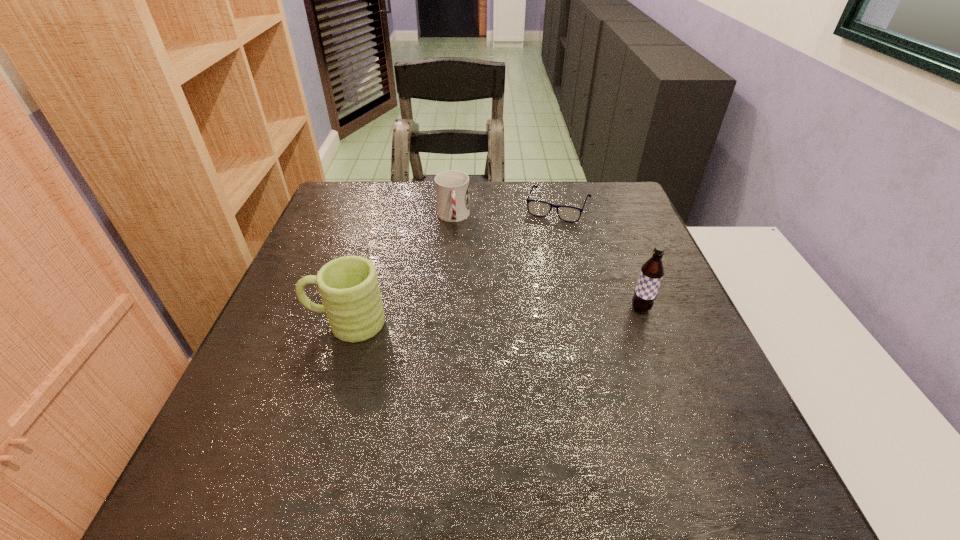
In the image, there is a desktop. At what (x,y) coordinates should I click in order to perform the action: click on vacant space at the near edge. Please return your answer as a coordinate pair (x, y). Looking at the image, I should click on (335, 402).

In the image, there is a desktop. Find the location of `vacant space at the left edge`. vacant space at the left edge is located at coordinates coord(264,346).

This screenshot has height=540, width=960. I want to click on vacant space at the near left corner, so click(x=257, y=432).

In the image, there is a desktop. Identify the location of vacant space at the far right corner. The image size is (960, 540). (601, 207).

In order to click on free space at the near right corner in this screenshot , I will do `click(728, 417)`.

Identify the location of free space between the cup and the second tallest object. (399, 270).

Identify the location of free area in between the cup and the tallest object. The width and height of the screenshot is (960, 540). (547, 263).

Find the location of a particular element. The width and height of the screenshot is (960, 540). free spot between the cup and the spectacles is located at coordinates (506, 212).

Image resolution: width=960 pixels, height=540 pixels. Find the location of `vacant region between the shortest object and the second object from left to right`. vacant region between the shortest object and the second object from left to right is located at coordinates (506, 212).

At what (x,y) coordinates should I click in order to perform the action: click on free space between the mug and the root beer. Please return your answer as a coordinate pair (x, y). The width and height of the screenshot is (960, 540). Looking at the image, I should click on (493, 316).